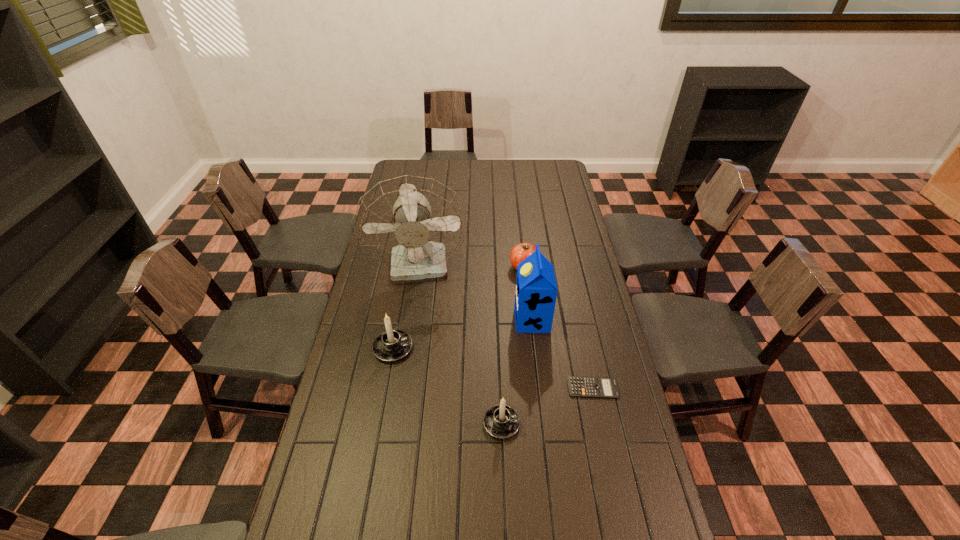
The width and height of the screenshot is (960, 540). What are the coordinates of `free space that satisfies the following two spatial constraints: 1. with the cap open on the fifth shortest object; 2. on the right side of the rightmost object` in the screenshot? It's located at (540, 388).

Where is `blank space that satisfies the following two spatial constraints: 1. with a handle on the side of the farther candle holder; 2. on the back side of the calculator`? The image size is (960, 540). blank space that satisfies the following two spatial constraints: 1. with a handle on the side of the farther candle holder; 2. on the back side of the calculator is located at coordinates (386, 388).